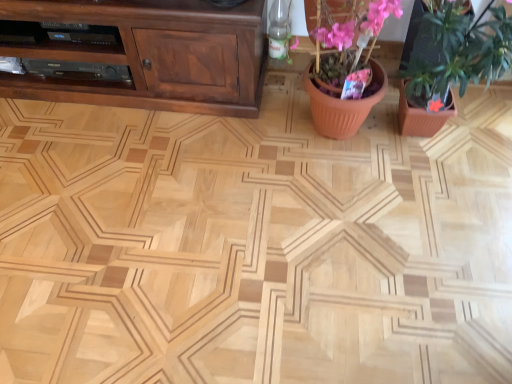
Question: Is terracotta pot at center a part of brown wood cabinet at upper left?

Choices:
 (A) no
 (B) yes

Answer: (A)

Question: From the image's perspective, is brown wood cabinet at upper left located beneath terracotta pot at center?

Choices:
 (A) yes
 (B) no

Answer: (B)

Question: From a real-world perspective, is brown wood cabinet at upper left under terracotta pot at center?

Choices:
 (A) no
 (B) yes

Answer: (B)

Question: Does brown wood cabinet at upper left have a lesser height compared to terracotta pot at center?

Choices:
 (A) no
 (B) yes

Answer: (B)

Question: From the image's perspective, is brown wood cabinet at upper left on terracotta pot at center?

Choices:
 (A) no
 (B) yes

Answer: (B)

Question: Is brown wood cabinet at upper left not within terracotta pot at center?

Choices:
 (A) yes
 (B) no

Answer: (A)

Question: Considering the relative positions of pink matte flower pot at upper right and brown wood cabinet at upper left in the image provided, is pink matte flower pot at upper right in front of brown wood cabinet at upper left?

Choices:
 (A) yes
 (B) no

Answer: (A)

Question: Does pink matte flower pot at upper right have a greater height compared to brown wood cabinet at upper left?

Choices:
 (A) yes
 (B) no

Answer: (A)

Question: Can you confirm if pink matte flower pot at upper right is smaller than brown wood cabinet at upper left?

Choices:
 (A) yes
 (B) no

Answer: (B)

Question: Can you confirm if pink matte flower pot at upper right is positioned to the left of brown wood cabinet at upper left?

Choices:
 (A) no
 (B) yes

Answer: (A)

Question: From the image's perspective, is pink matte flower pot at upper right located beneath brown wood cabinet at upper left?

Choices:
 (A) no
 (B) yes

Answer: (B)

Question: Is pink matte flower pot at upper right positioned behind brown wood cabinet at upper left?

Choices:
 (A) no
 (B) yes

Answer: (A)

Question: Considering the relative sizes of terracotta pot at center and pink matte flower pot at upper right in the image provided, is terracotta pot at center bigger than pink matte flower pot at upper right?

Choices:
 (A) no
 (B) yes

Answer: (A)